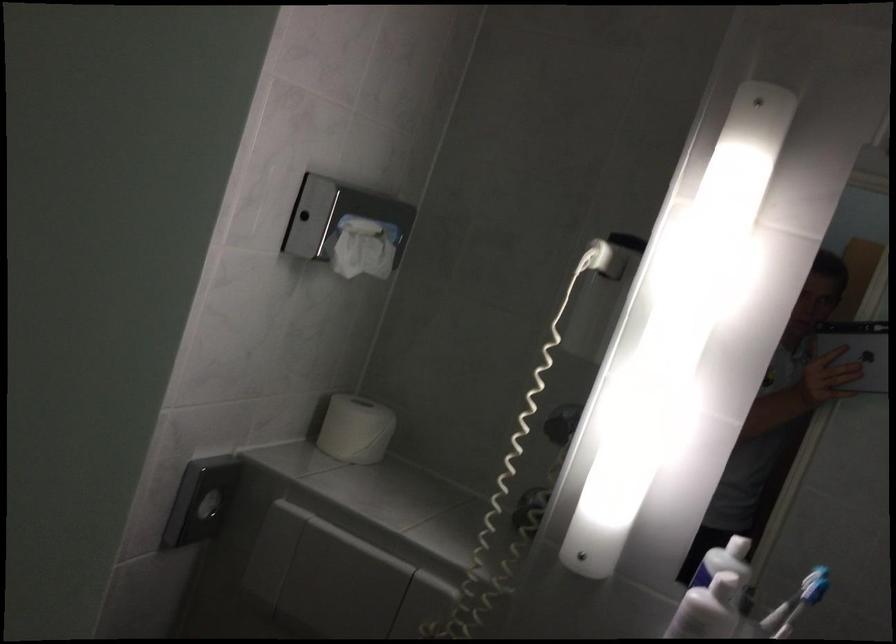
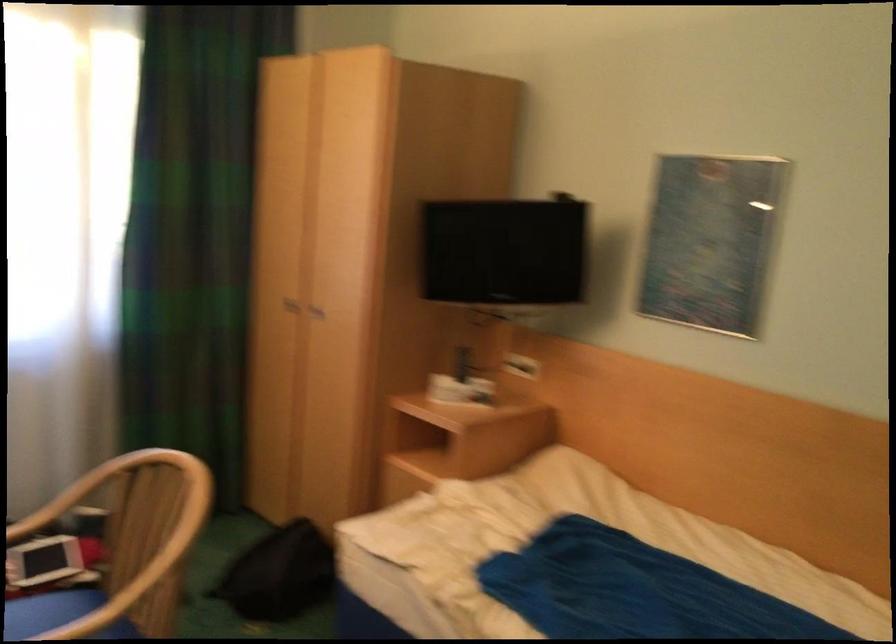
Question: The images are taken continuously from a first-person perspective. In which direction are you moving?

Choices:
 (A) Left
 (B) Right
 (C) Forward
 (D) Backward

Answer: (A)